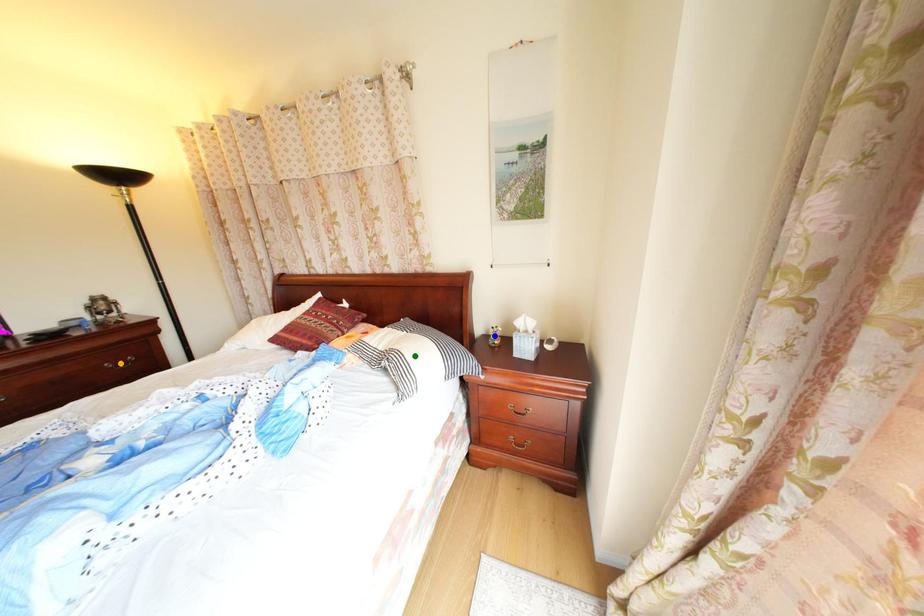
Order these from nearest to farthest:
orange point
green point
blue point

green point < orange point < blue point